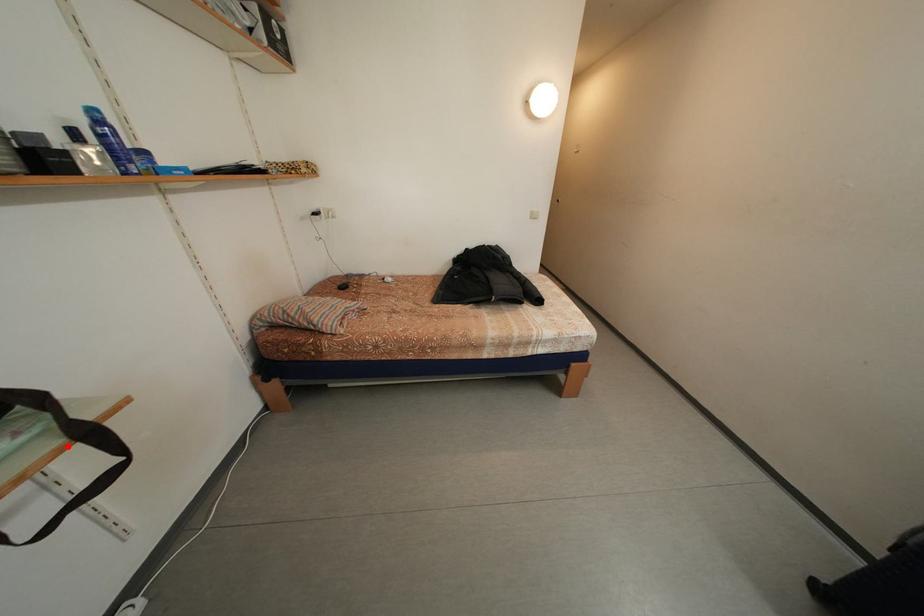
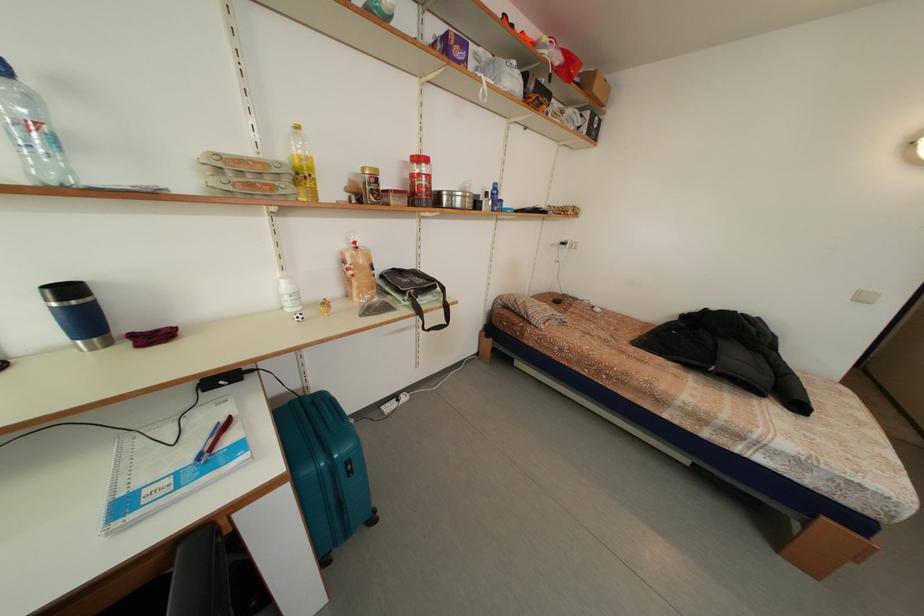
In the second image, find the point that corresponds to the highlighted location in the first image.

(448, 310)